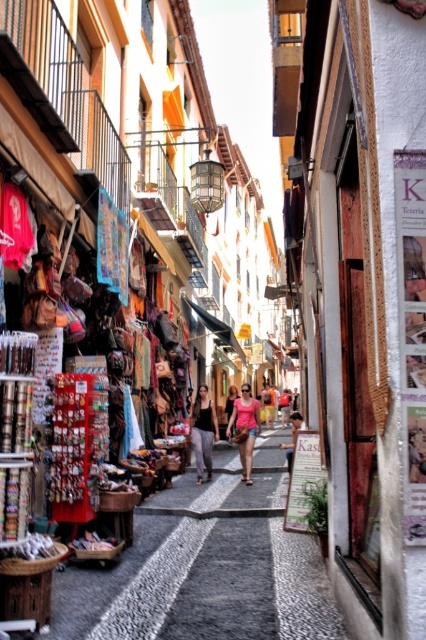
You are a customer browsing the market stall and want to buy both the pink fabric shorts at center and the matte black tank top at center. However, you have a size constraint that requires the item to be no taller than 12 inches. Which item is more likely to fit your requirement?

The pink fabric shorts at center is shorter than the matte black tank top at center, so the pink fabric shorts at center is more likely to fit the requirement of being no taller than 12 inches.

You are standing in the middle of the alley and want to walk towards the market stall on the left. There are two points marked on the ground ahead of you. One is at point (241, 387) and the other is at point (195, 454). Which point should you step on first to reach the market stall?

You should step on point (195, 454) first because point (241, 387) is behind it, meaning the closer point to you is point (195, 454).

You are standing at the entrance of the alley and want to buy the pink fabric shorts at center. To reach them, you need to walk over the smooth stone alley at center. Is the path clear?

The smooth stone alley at center is located below the pink fabric shorts at center, so the path is clear as the alley is beneath the shorts, allowing you to walk towards them without obstruction.